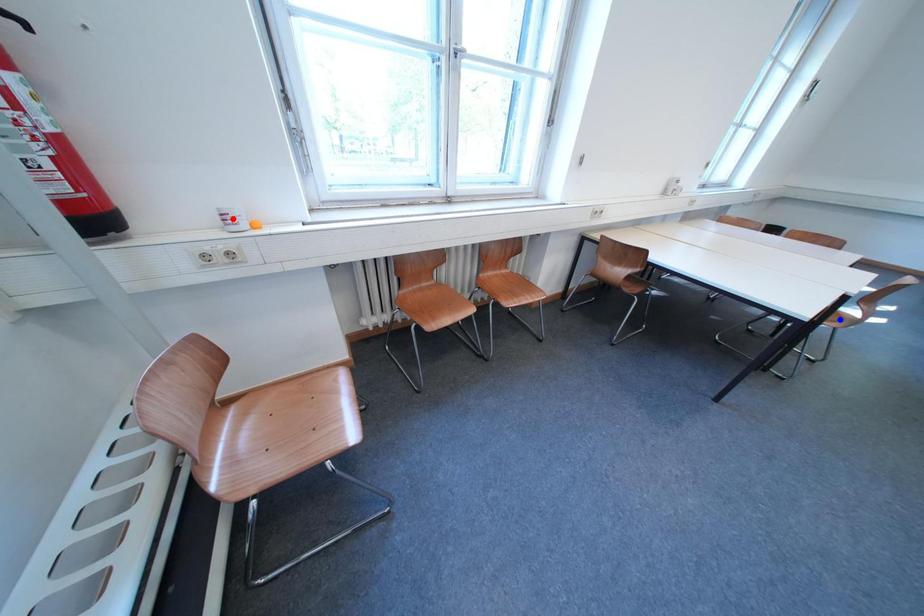
Question: Which of the two points in the image is closer to the camera?

Choices:
 (A) Blue point is closer.
 (B) Red point is closer.

Answer: (B)